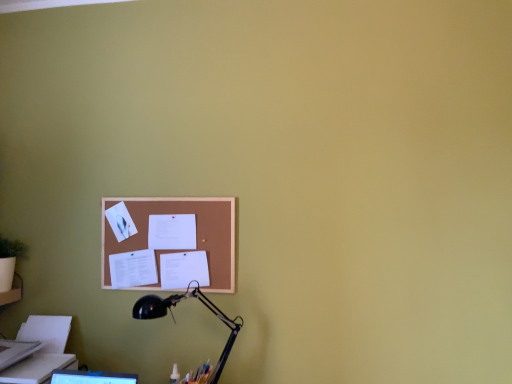
What do you see at coordinates (170, 313) in the screenshot? I see `black metal lamp at lower left` at bounding box center [170, 313].

You are a GUI agent. You are given a task and a screenshot of the screen. Output one action in this format:
    pyautogui.click(x=<x>, y=<y>)
    Task: Click on the corkboard at center
    The image size is (512, 384).
    Given the screenshot: What is the action you would take?
    pyautogui.click(x=197, y=235)

You are a GUI agent. You are given a task and a screenshot of the screen. Output one action in this format:
    pyautogui.click(x=<x>, y=<y>)
    Task: Click on the black metal lamp at lower left
    
    Given the screenshot: What is the action you would take?
    pyautogui.click(x=170, y=313)

Which is behind, white paper at center or corkboard at center?

Positioned behind is white paper at center.

Who is bigger, white paper at center or corkboard at center?

Bigger between the two is corkboard at center.

From the image's perspective, between white paper at center and corkboard at center, who is located below?

corkboard at center appears lower in the image.

Image resolution: width=512 pixels, height=384 pixels. I want to click on paper on the right of white paper at lower left, so click(172, 232).

Is white paper at center a part of white paper at lower left?

Actually, white paper at center is outside white paper at lower left.

Visually, is white paper at lower left positioned to the left or to the right of white paper at center?

From the image, it's evident that white paper at lower left is to the left of white paper at center.

Is white paper at center to the right of white paper at lower left from the viewer's perspective?

Correct, you'll find white paper at center to the right of white paper at lower left.

How different are the orientations of white paper at center and white paper at lower left in degrees?

There is a 0.821-degree angle between the facing directions of white paper at center and white paper at lower left.

From the image's perspective, which is above, white paper at center or white paper at lower left?

white paper at center.

Is white paper at center looking in the opposite direction of black metal lamp at lower left?

No, white paper at center is not facing the opposite direction of black metal lamp at lower left.

Which of these two, white paper at center or black metal lamp at lower left, is bigger?

With larger size is black metal lamp at lower left.

Is white paper at center inside the boundaries of black metal lamp at lower left, or outside?

white paper at center lies outside black metal lamp at lower left.

Considering the sizes of white paper at center and black metal lamp at lower left in the image, is white paper at center wider or thinner than black metal lamp at lower left?

Considering their sizes, white paper at center looks slimmer than black metal lamp at lower left.

Looking at this image, which object is thinner, corkboard at center or white paper at lower left?

corkboard at center is thinner.

Is the depth of corkboard at center less than that of white paper at lower left?

No.

Considering the relative sizes of corkboard at center and white paper at lower left in the image provided, is corkboard at center shorter than white paper at lower left?

No, corkboard at center is not shorter than white paper at lower left.

Is corkboard at center next to white paper at lower left and touching it?

There is a gap between corkboard at center and white paper at lower left.

Measure the distance between corkboard at center and black metal lamp at lower left.

corkboard at center and black metal lamp at lower left are 8.17 inches apart.

Is corkboard at center wider than black metal lamp at lower left?

No, corkboard at center is not wider than black metal lamp at lower left.

From a real-world perspective, which object stands above the other?

corkboard at center is physically above.

From the image's perspective, relative to black metal lamp at lower left, is corkboard at center above or below?

corkboard at center is situated higher than black metal lamp at lower left in the image.

From a real-world perspective, does white paper at lower left sit lower than corkboard at center?

Yes, from a real-world perspective, white paper at lower left is under corkboard at center.

Considering the points (55, 342) and (218, 248), which point is behind, point (55, 342) or point (218, 248)?

The point (55, 342) is farther.

From the image's perspective, which object appears higher, white paper at lower left or corkboard at center?

From the image's view, corkboard at center is above.

Is white paper at lower left oriented towards corkboard at center?

No, white paper at lower left is not oriented towards corkboard at center.

Find the location of `bulletin board in front of the white paper at center`. bulletin board in front of the white paper at center is located at coordinates point(197,235).

Locate an element on the screen. This screenshot has width=512, height=384. paper behind the white paper at lower left is located at coordinates (172, 232).

When comparing their distances from white paper at lower left, does corkboard at center or black metal lamp at lower left seem closer?

Based on the image, black metal lamp at lower left appears to be nearer to white paper at lower left.

Looking at the image, which one is located closer to black metal lamp at lower left, corkboard at center or white paper at lower left?

corkboard at center.

When comparing their distances from white paper at center, does corkboard at center or white paper at lower left seem further?

Based on the image, white paper at lower left appears to be further to white paper at center.

Which object lies nearer to the anchor point corkboard at center, white paper at center or black metal lamp at lower left?

white paper at center is positioned closer to the anchor corkboard at center.

Looking at the image, which one is located closer to black metal lamp at lower left, white paper at lower left or corkboard at center?

corkboard at center lies closer to black metal lamp at lower left than the other object.

From the image, which object appears to be farther from white paper at center, black metal lamp at lower left or corkboard at center?

black metal lamp at lower left.

Which object lies nearer to the anchor point white paper at lower left, corkboard at center or white paper at center?

corkboard at center is closer to white paper at lower left.

Which object lies nearer to the anchor point corkboard at center, white paper at lower left or black metal lamp at lower left?

black metal lamp at lower left.

I want to click on bulletin board between white paper at center and black metal lamp at lower left from top to bottom, so click(x=197, y=235).

I want to click on bulletin board between white paper at lower left and white paper at center, so click(197, 235).

Identify the location of paper between white paper at lower left and black metal lamp at lower left in the horizontal direction. (172, 232).

The image size is (512, 384). Identify the location of bulletin board between white paper at lower left and black metal lamp at lower left from left to right. (197, 235).